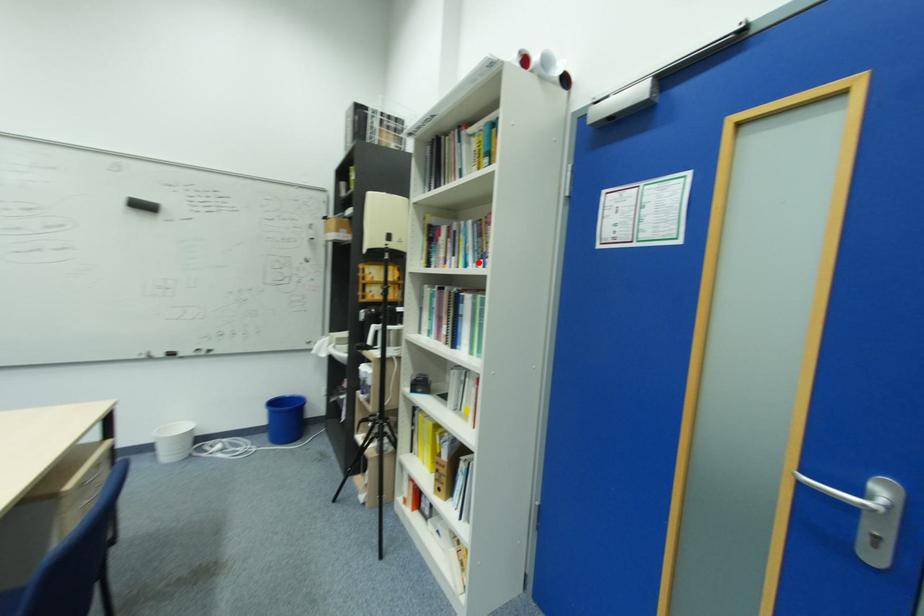
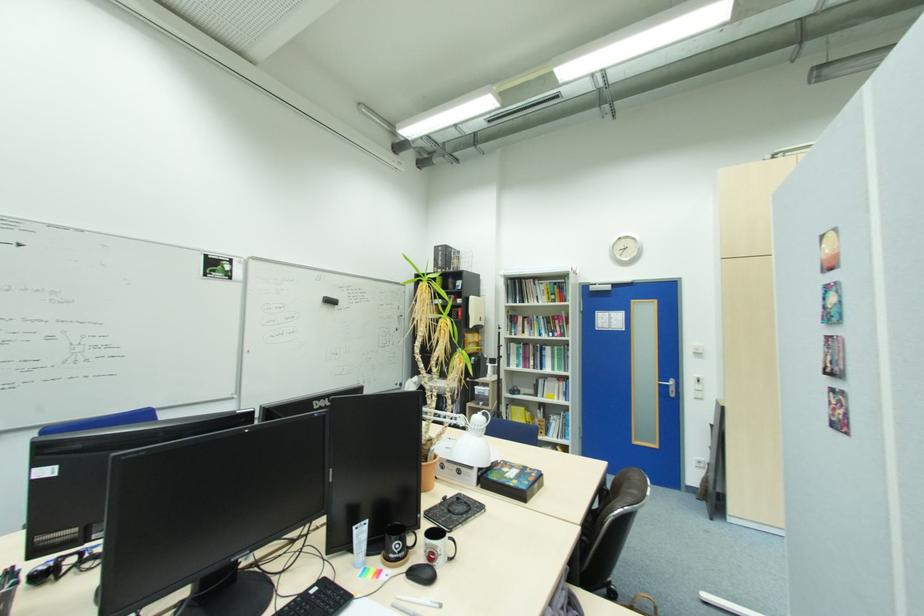
Where in the second image is the point corresponding to the highlighted location from the first image?

(550, 334)